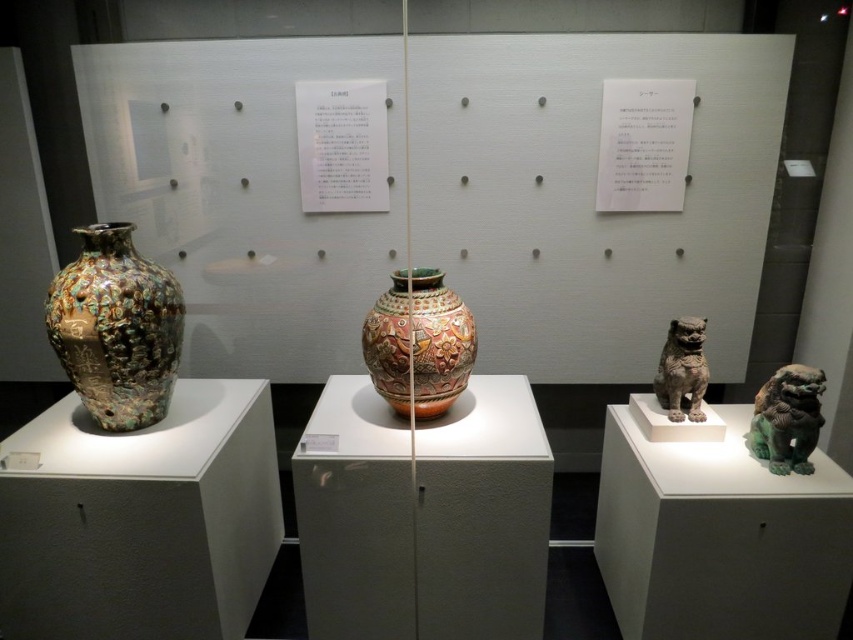
Question: Where is white paper at center located in relation to bronze statue at center right in the image?

Choices:
 (A) left
 (B) right

Answer: (A)

Question: Can you confirm if shiny multicolored vase at left is wider than multicolored glazed vase at center?

Choices:
 (A) yes
 (B) no

Answer: (A)

Question: Among these points, which one is nearest to the camera?

Choices:
 (A) (769, 417)
 (B) (672, 413)

Answer: (A)

Question: Among these objects, which one is farthest from the camera?

Choices:
 (A) multicolored glazed vase at center
 (B) shiny multicolored vase at left
 (C) bronze statue at center right
 (D) white paper at center

Answer: (D)

Question: Can you confirm if green patina stone lion at right is wider than bronze statue at center right?

Choices:
 (A) no
 (B) yes

Answer: (A)

Question: Which point is farther from the camera taking this photo?

Choices:
 (A) (114, 387)
 (B) (756, 444)
 (C) (300, 308)
 (D) (662, 392)

Answer: (C)